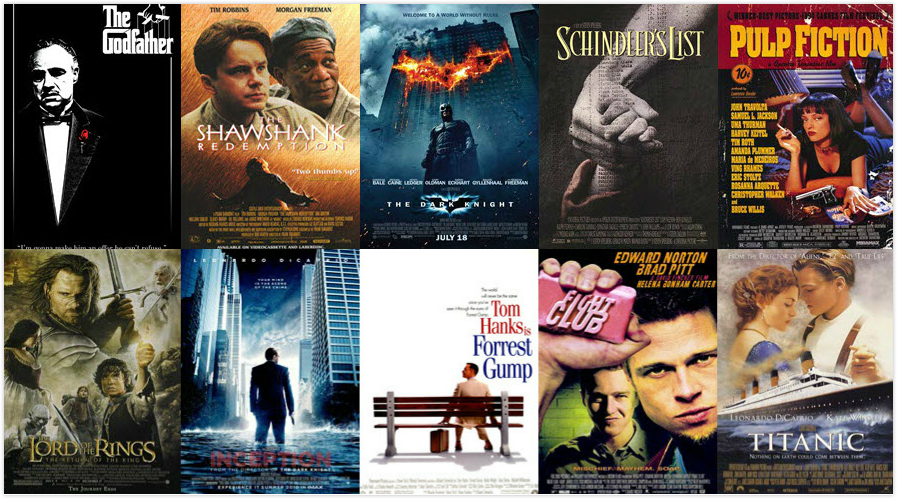
Find the location of a particular element. This screenshot has width=897, height=499. movie posters is located at coordinates (112, 332), (438, 356), (274, 358), (643, 340), (823, 374), (815, 164), (640, 137), (483, 116), (254, 132), (131, 126).